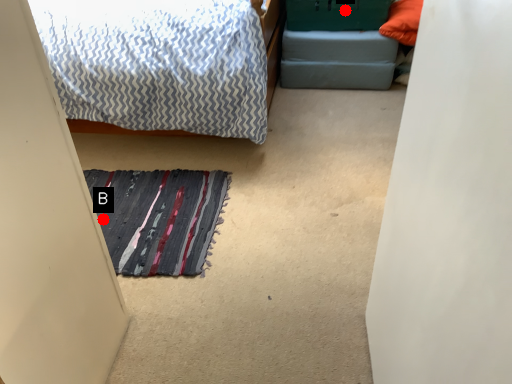
Question: Two points are circled on the image, labeled by A and B beside each circle. Which point is farther from the camera taking this photo?

Choices:
 (A) A is further
 (B) B is further

Answer: (A)